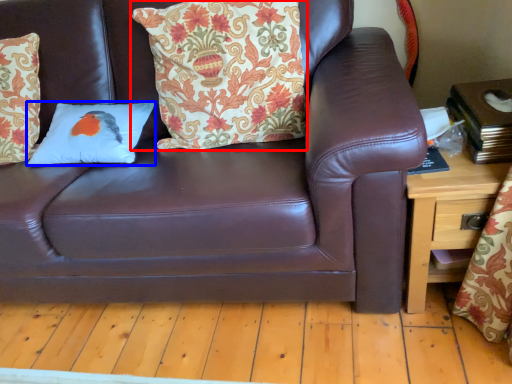
Question: Among these objects, which one is farthest to the camera, pillow (highlighted by a red box) or pillow (highlighted by a blue box)?

Choices:
 (A) pillow
 (B) pillow

Answer: (B)